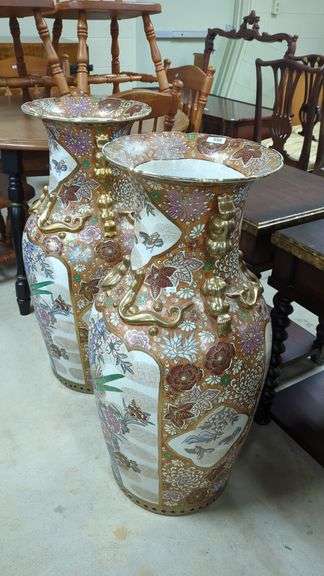
Locate an element on the screen. The image size is (324, 576). vanity is located at coordinates (220, 108).